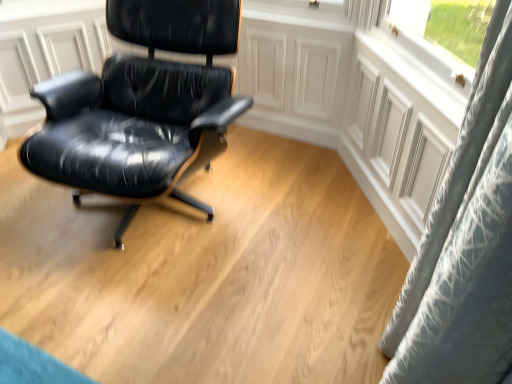
Question: Is glossy black leather chair at center to the right of blue textured curtain at upper right from the viewer's perspective?

Choices:
 (A) no
 (B) yes

Answer: (A)

Question: Is glossy black leather chair at center directly adjacent to blue textured curtain at upper right?

Choices:
 (A) yes
 (B) no

Answer: (B)

Question: Is blue textured curtain at upper right a part of glossy black leather chair at center?

Choices:
 (A) yes
 (B) no

Answer: (B)

Question: From the image's perspective, does glossy black leather chair at center appear higher than blue textured curtain at upper right?

Choices:
 (A) yes
 (B) no

Answer: (A)

Question: Is glossy black leather chair at center behind blue textured curtain at upper right?

Choices:
 (A) yes
 (B) no

Answer: (B)

Question: Can you confirm if glossy black leather chair at center is smaller than blue textured curtain at upper right?

Choices:
 (A) yes
 (B) no

Answer: (B)

Question: From a real-world perspective, is blue textured curtain at upper right positioned under glossy black leather chair at center based on gravity?

Choices:
 (A) no
 (B) yes

Answer: (B)

Question: Is blue textured curtain at upper right oriented away from glossy black leather chair at center?

Choices:
 (A) no
 (B) yes

Answer: (A)

Question: Can you confirm if blue textured curtain at upper right is smaller than glossy black leather chair at center?

Choices:
 (A) yes
 (B) no

Answer: (A)

Question: From the image's perspective, is blue textured curtain at upper right on top of glossy black leather chair at center?

Choices:
 (A) no
 (B) yes

Answer: (A)

Question: From the image's perspective, is blue textured curtain at upper right beneath glossy black leather chair at center?

Choices:
 (A) yes
 (B) no

Answer: (A)

Question: Are blue textured curtain at upper right and glossy black leather chair at center located far from each other?

Choices:
 (A) yes
 (B) no

Answer: (A)

Question: From their relative heights in the image, would you say glossy black leather chair at center is taller or shorter than blue textured curtain at upper right?

Choices:
 (A) tall
 (B) short

Answer: (A)